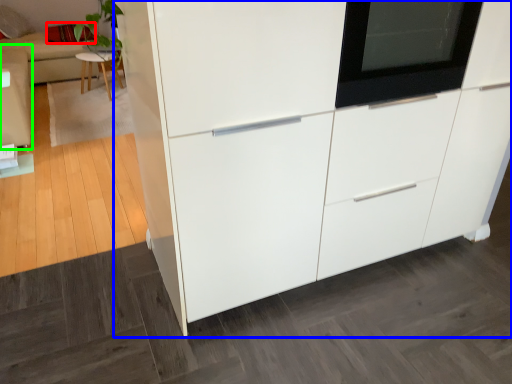
Question: Which object is positioned closest to pillow (highlighted by a red box)? Select from cabinetry (highlighted by a blue box) and couch (highlighted by a green box).

Choices:
 (A) cabinetry
 (B) couch

Answer: (B)